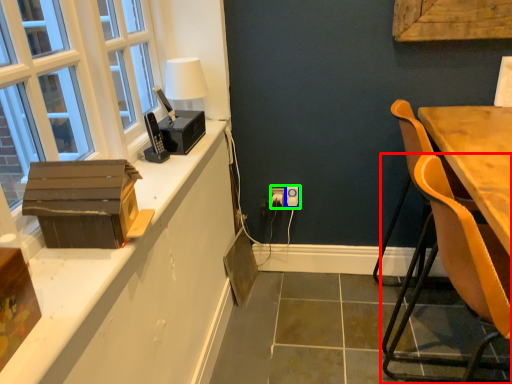
Question: Which object is the farthest from chair (highlighted by a red box)? Choose among these: power outlet (highlighted by a blue box) or electric outlet (highlighted by a green box).

Choices:
 (A) power outlet
 (B) electric outlet

Answer: (A)